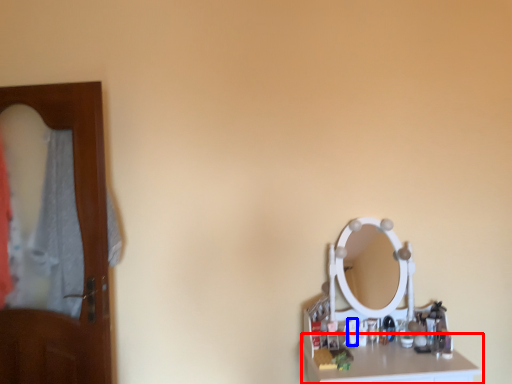
Question: Which object is further to the camera taking this photo, counter top (highlighted by a red box) or toiletry (highlighted by a blue box)?

Choices:
 (A) counter top
 (B) toiletry

Answer: (B)